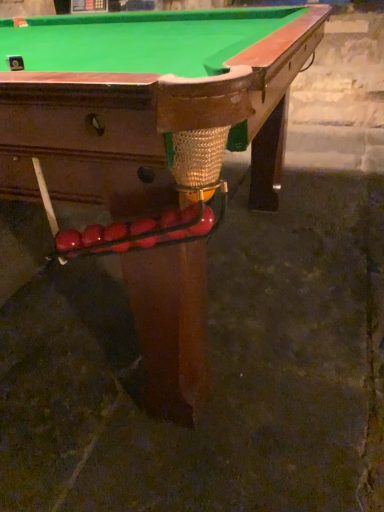
What are the coordinates of `shiny brown wood billiard table at center` in the screenshot? It's located at (150, 106).

What do you see at coordinates (150, 106) in the screenshot?
I see `shiny brown wood billiard table at center` at bounding box center [150, 106].

The height and width of the screenshot is (512, 384). What do you see at coordinates (68, 243) in the screenshot?
I see `glossy red balls at lower left` at bounding box center [68, 243].

Locate an element on the screen. This screenshot has width=384, height=512. glossy red balls at lower left is located at coordinates (68, 243).

Find the location of `shiny brown wood billiard table at center`. shiny brown wood billiard table at center is located at coordinates (150, 106).

Visually, is glossy red balls at lower left positioned to the left or to the right of shiny brown wood billiard table at center?

Based on their positions, glossy red balls at lower left is located to the right of shiny brown wood billiard table at center.

Is the position of glossy red balls at lower left less distant than that of shiny brown wood billiard table at center?

That is False.

Which is more distant, (65, 233) or (149, 328)?

The point (149, 328) is farther from the camera.

From the image's perspective, does glossy red balls at lower left appear higher than shiny brown wood billiard table at center?

Actually, glossy red balls at lower left appears below shiny brown wood billiard table at center in the image.

From a real-world perspective, is glossy red balls at lower left on shiny brown wood billiard table at center?

Indeed, from a real-world perspective, glossy red balls at lower left stands above shiny brown wood billiard table at center.

Considering the relative sizes of glossy red balls at lower left and shiny brown wood billiard table at center in the image provided, is glossy red balls at lower left wider than shiny brown wood billiard table at center?

No.

Considering the relative sizes of glossy red balls at lower left and shiny brown wood billiard table at center in the image provided, is glossy red balls at lower left taller than shiny brown wood billiard table at center?

No, glossy red balls at lower left is not taller than shiny brown wood billiard table at center.

Does glossy red balls at lower left have a smaller size compared to shiny brown wood billiard table at center?

Yes, glossy red balls at lower left is smaller than shiny brown wood billiard table at center.

Is shiny brown wood billiard table at center surrounded by glossy red balls at lower left?

Definitely not — shiny brown wood billiard table at center is not inside glossy red balls at lower left.

Consider the image. Does glossy red balls at lower left touch shiny brown wood billiard table at center?

No, glossy red balls at lower left is not making contact with shiny brown wood billiard table at center.

Could you tell me if glossy red balls at lower left is turned towards shiny brown wood billiard table at center?

Yes.

Find the location of a particular element. This screenshot has width=384, height=512. fruit that is below the shiny brown wood billiard table at center (from the image's perspective) is located at coordinates (68, 243).

Which object is positioned more to the right, shiny brown wood billiard table at center or glossy red balls at lower left?

From the viewer's perspective, glossy red balls at lower left appears more on the right side.

In the image, is shiny brown wood billiard table at center positioned in front of or behind glossy red balls at lower left?

shiny brown wood billiard table at center is positioned closer to the viewer than glossy red balls at lower left.

Which is closer, (x=0, y=42) or (x=72, y=240)?

Point (x=0, y=42) is farther from the camera than point (x=72, y=240).

From the image's perspective, is shiny brown wood billiard table at center above or below glossy red balls at lower left?

Based on their image positions, shiny brown wood billiard table at center is located above glossy red balls at lower left.

From a real-world perspective, is shiny brown wood billiard table at center positioned over glossy red balls at lower left based on gravity?

No, from a real-world perspective, shiny brown wood billiard table at center is not over glossy red balls at lower left

Looking at their sizes, would you say shiny brown wood billiard table at center is wider or thinner than glossy red balls at lower left?

In the image, shiny brown wood billiard table at center appears to be wider than glossy red balls at lower left.

In terms of height, does shiny brown wood billiard table at center look taller or shorter compared to glossy red balls at lower left?

In the image, shiny brown wood billiard table at center appears to be taller than glossy red balls at lower left.

Considering the relative sizes of shiny brown wood billiard table at center and glossy red balls at lower left in the image provided, is shiny brown wood billiard table at center bigger than glossy red balls at lower left?

Yes.

Looking at this image, can glossy red balls at lower left be found inside shiny brown wood billiard table at center?

Yes, glossy red balls at lower left is surrounded by shiny brown wood billiard table at center.

Is shiny brown wood billiard table at center directly adjacent to glossy red balls at lower left?

There is a gap between shiny brown wood billiard table at center and glossy red balls at lower left.

Is shiny brown wood billiard table at center oriented towards glossy red balls at lower left?

Yes, shiny brown wood billiard table at center faces towards glossy red balls at lower left.

How distant is shiny brown wood billiard table at center from glossy red balls at lower left?

shiny brown wood billiard table at center and glossy red balls at lower left are 54.01 centimeters apart from each other.

The image size is (384, 512). Find the location of `billiard table below the glossy red balls at lower left (from a real-world perspective)`. billiard table below the glossy red balls at lower left (from a real-world perspective) is located at coordinates (150, 106).

At what (x,y) coordinates should I click in order to perform the action: click on billiard table directly beneath the glossy red balls at lower left (from a real-world perspective). Please return your answer as a coordinate pair (x, y). Looking at the image, I should click on (150, 106).

Locate an element on the screen. This screenshot has width=384, height=512. billiard table above the glossy red balls at lower left (from the image's perspective) is located at coordinates tap(150, 106).